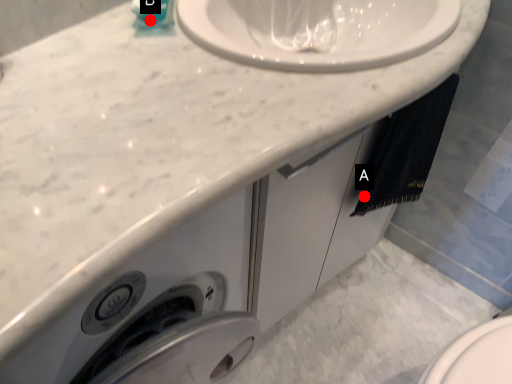
Question: Two points are circled on the image, labeled by A and B beside each circle. Which point is closer to the camera?

Choices:
 (A) A is closer
 (B) B is closer

Answer: (B)